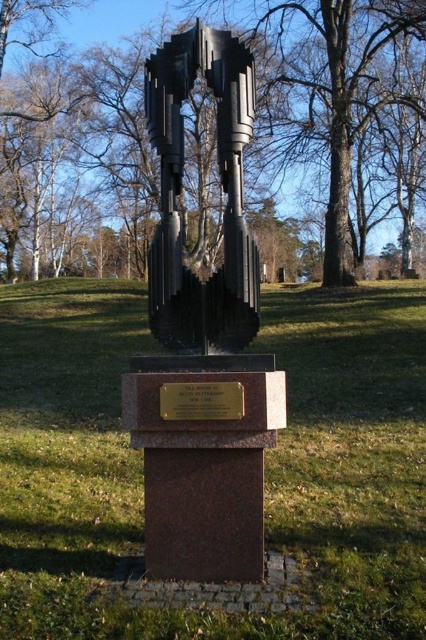
Does black metal tree at center have a lesser width compared to polished bronze sculpture at center?

Incorrect, black metal tree at center's width is not less than polished bronze sculpture at center's.

Between point (368, 112) and point (172, 81), which one is positioned behind?

Point (368, 112)

Does point (144, 56) come behind point (152, 541)?

That is True.

Find the location of a particular element. black metal tree at center is located at coordinates (336, 104).

Which is more to the left, green grass at center or black metal tree at center?

Positioned to the left is black metal tree at center.

This screenshot has width=426, height=640. Find the location of `green grass at center`. green grass at center is located at coordinates (264, 461).

Describe the element at coordinates (264, 461) in the screenshot. The height and width of the screenshot is (640, 426). I see `green grass at center` at that location.

Does green grass at center have a lesser width compared to gold plated metal plaque at center?

In fact, green grass at center might be wider than gold plated metal plaque at center.

What do you see at coordinates (264, 461) in the screenshot? This screenshot has width=426, height=640. I see `green grass at center` at bounding box center [264, 461].

This screenshot has width=426, height=640. Identify the location of green grass at center. (264, 461).